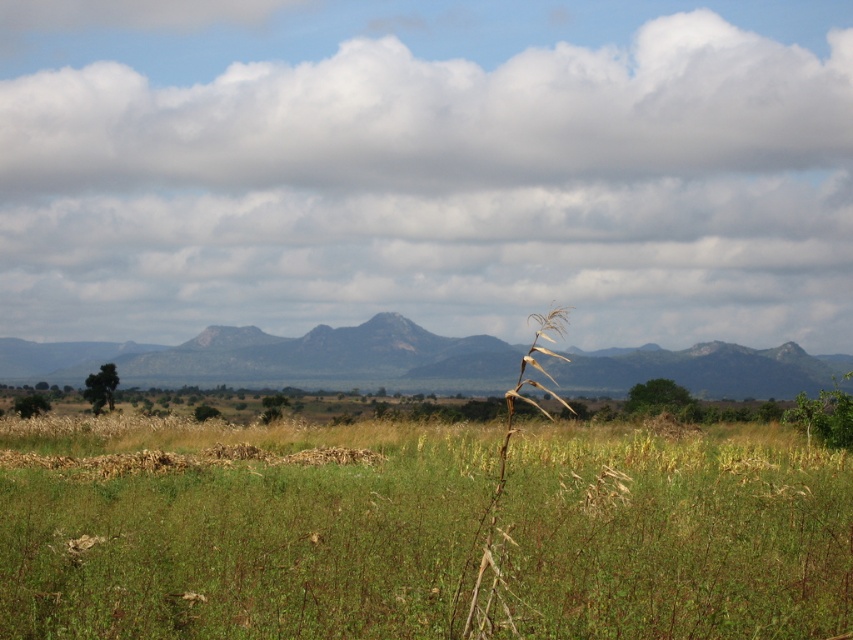
Measure the distance between green grassy at center and brown dry stalk at center.

They are 5.78 meters apart.

What do you see at coordinates (236, 529) in the screenshot?
I see `green grassy at center` at bounding box center [236, 529].

Which is in front, point (286, 508) or point (483, 554)?

Point (483, 554)

The image size is (853, 640). I want to click on green grassy at center, so click(236, 529).

In the scene shown: Can you confirm if white fluffy cloud at upper center is positioned to the right of green grassy at center?

No, white fluffy cloud at upper center is not to the right of green grassy at center.

You are a GUI agent. You are given a task and a screenshot of the screen. Output one action in this format:
    pyautogui.click(x=<x>, y=<y>)
    Task: Click on the white fluffy cloud at upper center
    This screenshot has width=853, height=640.
    Given the screenshot: What is the action you would take?
    pyautogui.click(x=427, y=168)

Between point (437, 348) and point (538, 330), which one is positioned in front?

Point (538, 330)

How far apart are rocky gray mountain at center and brown dry stalk at center?

They are 19.31 meters apart.

Locate an element on the screen. The height and width of the screenshot is (640, 853). rocky gray mountain at center is located at coordinates coord(281,356).